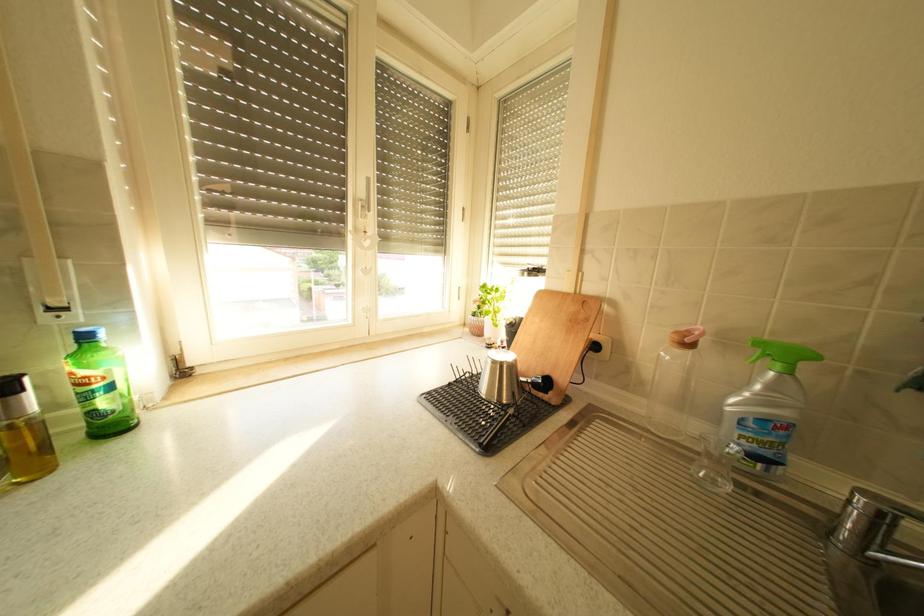
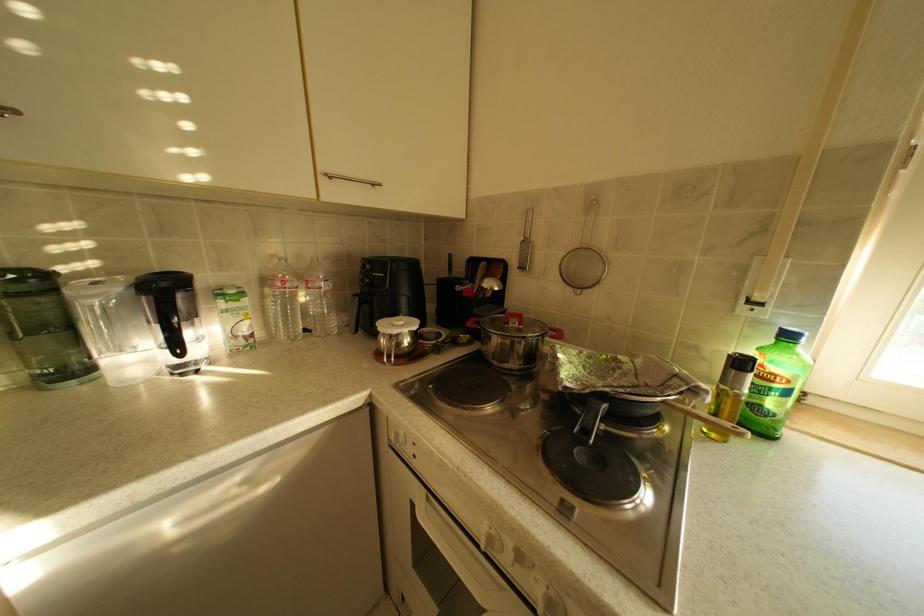
Question: The first image is from the beginning of the video and the second image is from the end. How did the camera likely rotate when shooting the video?

Choices:
 (A) Left
 (B) Right
 (C) Up
 (D) Down

Answer: (A)